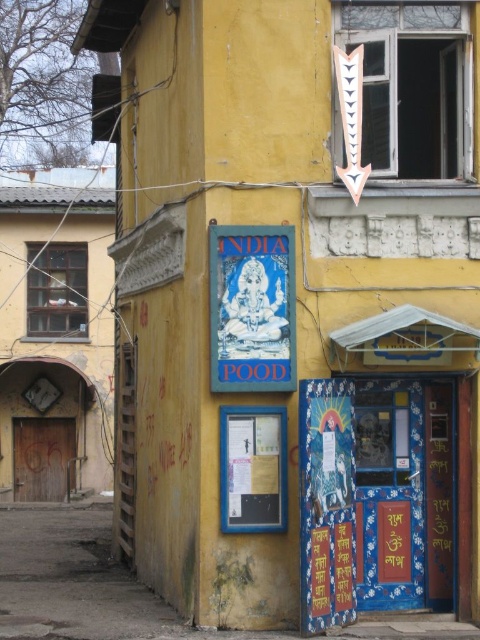
Does wooden door at left have a lesser width compared to blue paper sign at center?

Indeed, wooden door at left has a lesser width compared to blue paper sign at center.

Looking at this image, is wooden door at left taller than blue paper sign at center?

Incorrect, wooden door at left's height is not larger of blue paper sign at center's.

Which is in front, point (12, 464) or point (278, 344)?

Positioned in front is point (278, 344).

The width and height of the screenshot is (480, 640). I want to click on wooden door at left, so click(56, 333).

This screenshot has width=480, height=640. What do you see at coordinates (56, 333) in the screenshot? I see `wooden door at left` at bounding box center [56, 333].

Is wooden door at left bigger than blue paper poster at center?

Yes.

Is point (64, 257) closer to viewer compared to point (249, 460)?

That is False.

At what (x,y) coordinates should I click in order to perform the action: click on wooden door at left. Please return your answer as a coordinate pair (x, y). Looking at the image, I should click on (56, 333).

Which of these two, blue paper sign at center or blue paper poster at center, stands shorter?

blue paper poster at center is shorter.

Identify the location of blue paper sign at center. The height and width of the screenshot is (640, 480). (252, 308).